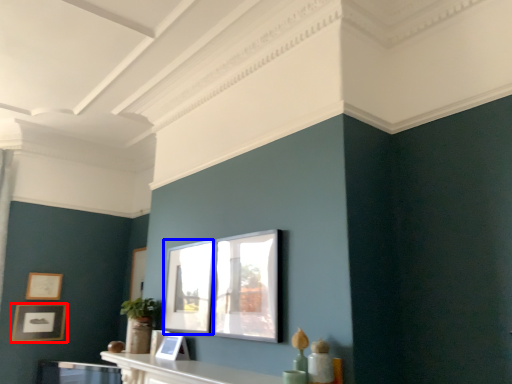
Question: Among these objects, which one is nearest to the camera, picture frame (highlighted by a red box) or window (highlighted by a blue box)?

Choices:
 (A) picture frame
 (B) window

Answer: (B)